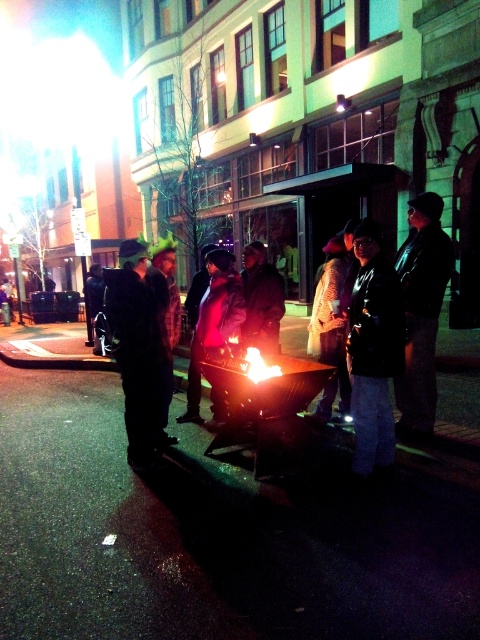
Is point (392, 374) closer to viewer compared to point (411, 406)?

Yes, it is.

Between dark gray hoodie at center and black leather jacket at center, which one appears on the right side from the viewer's perspective?

black leather jacket at center

Who is more distant from viewer, [395,305] or [432,316]?

Point [432,316]

You are a GUI agent. You are given a task and a screenshot of the screen. Output one action in this format:
    pyautogui.click(x=<x>, y=<y>)
    Task: Click on the dark gray hoodie at center
    
    Given the screenshot: What is the action you would take?
    pyautogui.click(x=373, y=349)

Based on the photo, can you confirm if black leather jacket at center is positioned above dark gray knit hat at center?

Actually, black leather jacket at center is below dark gray knit hat at center.

From the picture: Between black leather jacket at center and dark gray knit hat at center, which one has less height?

black leather jacket at center is shorter.

Locate an element on the screen. black leather jacket at center is located at coordinates (420, 310).

Identify the location of black leather jacket at center. The image size is (480, 640). (420, 310).

Which is above, black leather jacket at center or dark brown leather jacket at center?

dark brown leather jacket at center

Can you confirm if black leather jacket at center is positioned below dark brown leather jacket at center?

Yes.

Is point (417, 289) in front of point (248, 340)?

Yes, it is.

This screenshot has width=480, height=640. Find the location of `black leather jacket at center`. black leather jacket at center is located at coordinates (420, 310).